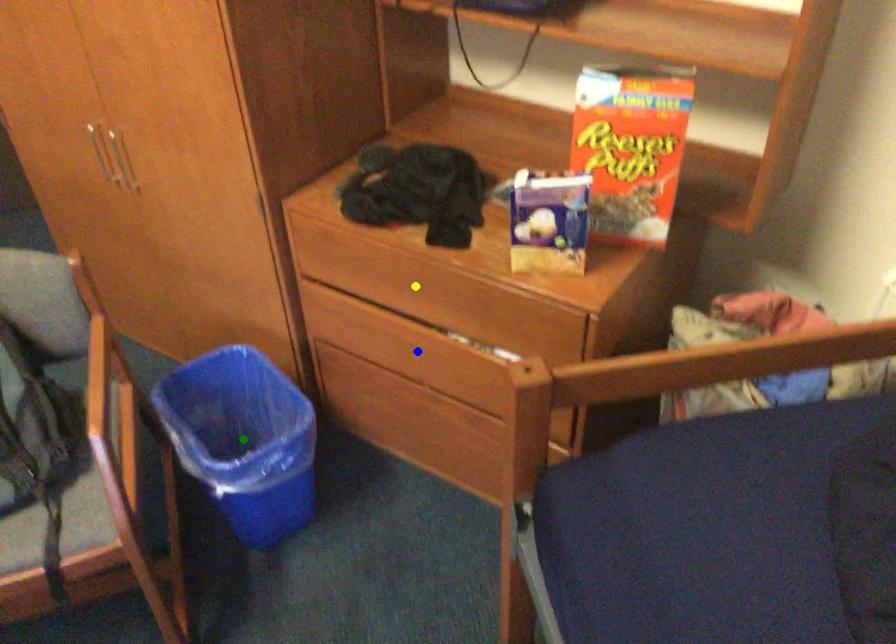
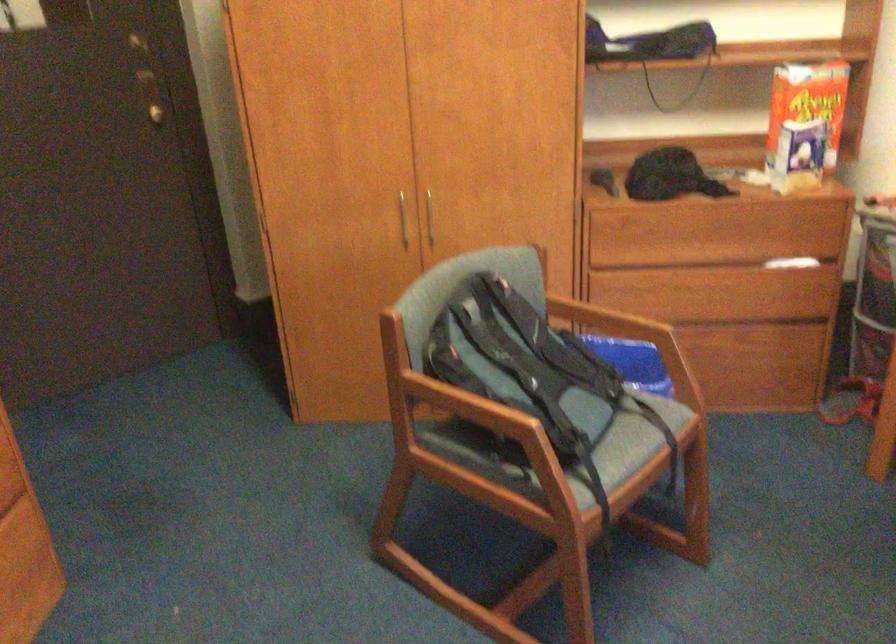
I am providing you with two images of the same scene from different viewpoints. Three points are marked in image1. Which point corresponds to a part or object that is occluded in image2?In image1, three points are marked. Which of them correspond to a part or object that is occluded in image2?Among the three points shown in image1, which one corresponds to a part or object that is no longer visible due to occlusion in image2?

Invisible in image2: green point.